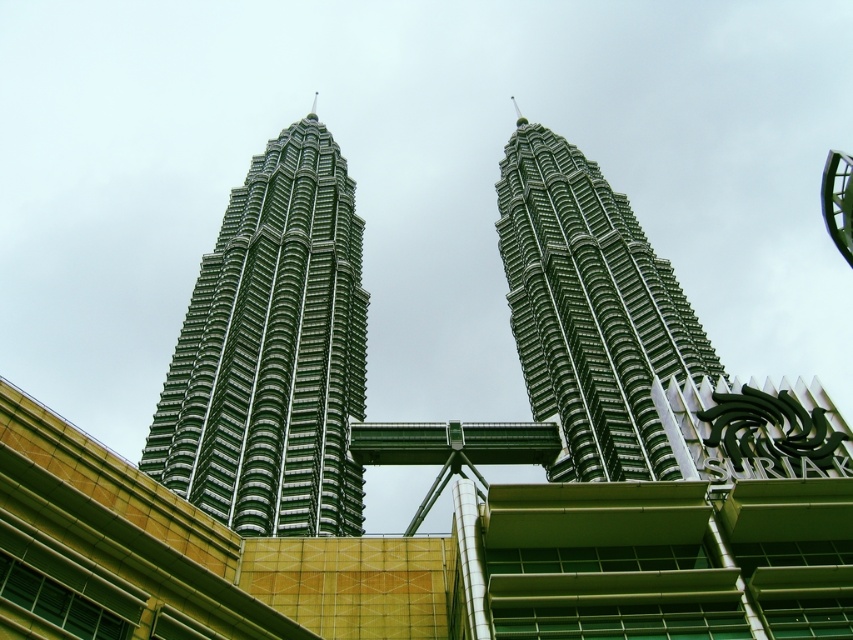
You are a photographer planning to capture the full height of both the green glassy skyscraper at center and the green metallic twin towers at center in a single shot. Based on their heights, which one might require you to adjust your camera angle to avoid cropping the top?

The green glassy skyscraper at center is shorter than the green metallic twin towers at center, so you would need to adjust your camera angle to ensure the taller green metallic twin towers at center fits fully in the frame without cropping.

You are a photographer standing in the foreground of the scene. You want to capture a photo of the green metallic twin towers at center without the green glassy skyscraper at center blocking the view. Is this possible given their positions?

The green glassy skyscraper at center is in front of the green metallic twin towers at center, so it will block the view. To capture the green metallic twin towers at center without obstruction, you need to move to a position where the green glassy skyscraper at center is not between you and the towers.

You are standing in front of the Petronas Twin Towers and want to take a photo. You notice two points in the scene labeled as point (x=293, y=448) and point (x=573, y=336). Which point is nearer to you?

Point (x=293, y=448) is closer to the viewer than point (x=573, y=336).